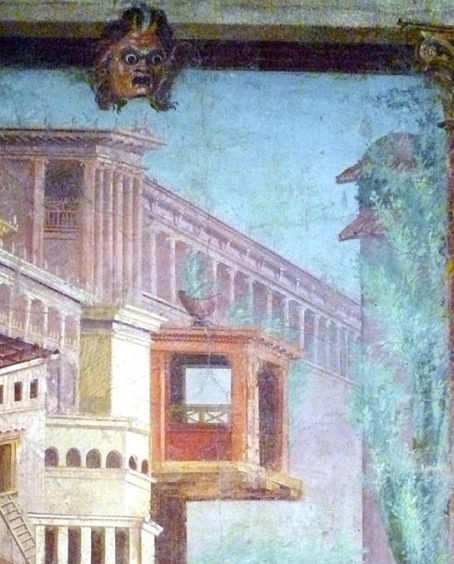
Find the location of a particular element. The height and width of the screenshot is (564, 454). cream colored wall is located at coordinates click(x=82, y=497), click(x=125, y=376).